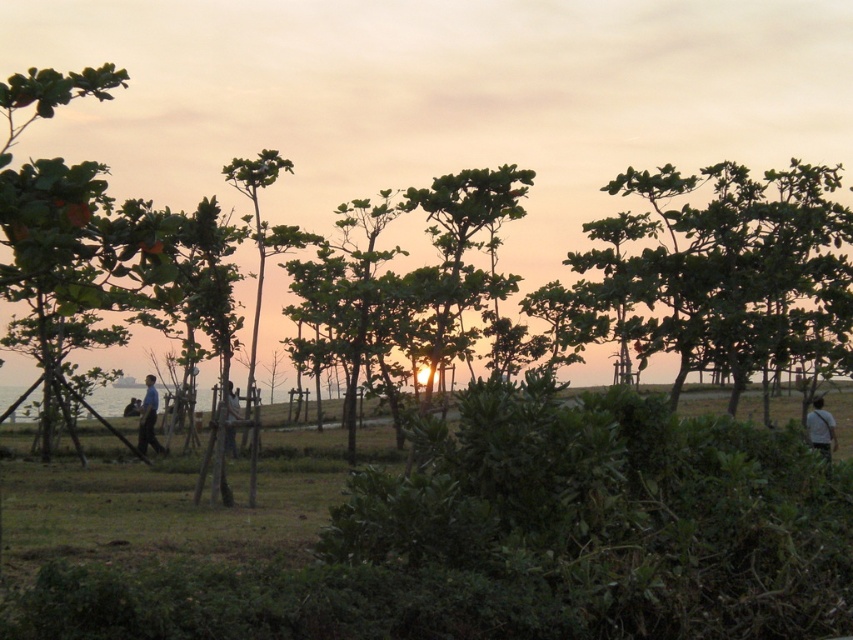
Consider the image. Between green matte tree at left and blue fabric shirt at center, which one appears on the right side from the viewer's perspective?

blue fabric shirt at center

Is point (138, 248) farther from camera compared to point (144, 420)?

No, (138, 248) is in front of (144, 420).

Locate an element on the screen. The width and height of the screenshot is (853, 640). green matte tree at left is located at coordinates (70, 237).

Can you confirm if light brown fabric shirt at lower right is bigger than blue fabric shirt at center?

Indeed, light brown fabric shirt at lower right has a larger size compared to blue fabric shirt at center.

Is point (817, 444) closer to camera compared to point (155, 417)?

Yes, point (817, 444) is in front of point (155, 417).

What do you see at coordinates (820, 428) in the screenshot? I see `light brown fabric shirt at lower right` at bounding box center [820, 428].

Find the location of a particular element. This screenshot has width=853, height=640. light brown fabric shirt at lower right is located at coordinates (820, 428).

Between blue fabric shirt at center and dark blue jeans at center, which one has less height?

blue fabric shirt at center

Between point (154, 384) and point (231, 413), which one is positioned behind?

Point (154, 384)

Find the location of a particular element. blue fabric shirt at center is located at coordinates (x=148, y=419).